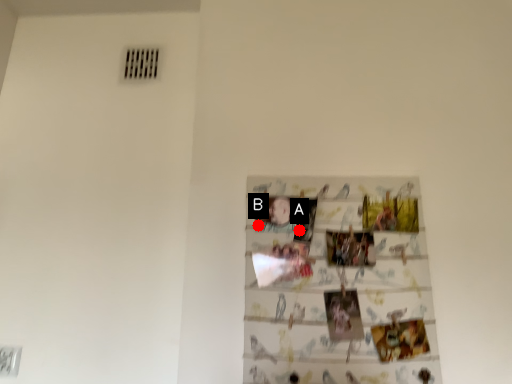
Question: Two points are circled on the image, labeled by A and B beside each circle. Which point is closer to the camera?

Choices:
 (A) A is closer
 (B) B is closer

Answer: (A)